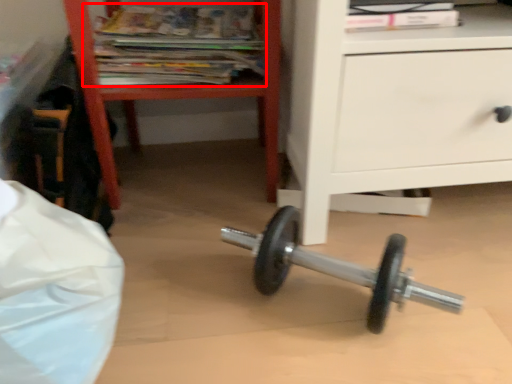
Question: From the image's perspective, where is magazine (annotated by the red box) located relative to furniture?

Choices:
 (A) below
 (B) above

Answer: (B)